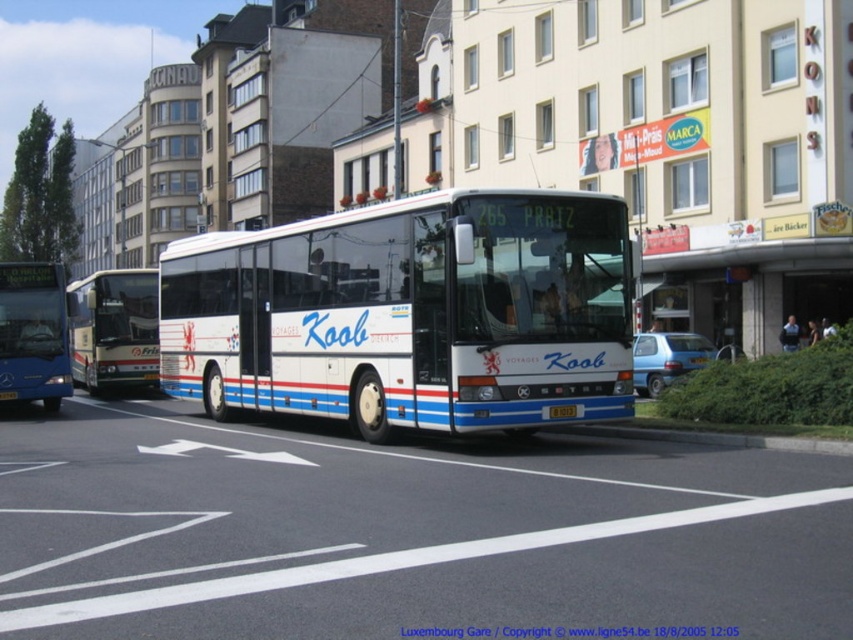
Question: Which point appears farthest from the camera in this image?

Choices:
 (A) coord(572,404)
 (B) coord(152,307)
 (C) coord(67,360)
 (D) coord(618,291)

Answer: (B)

Question: Does white glossy bus at center appear on the left side of matte silver bus at left?

Choices:
 (A) yes
 (B) no

Answer: (B)

Question: Which object is farther from the camera taking this photo?

Choices:
 (A) white glossy bus at center
 (B) matte silver bus at left
 (C) blue metallic bus at left

Answer: (B)

Question: Which of the following is the closest to the observer?

Choices:
 (A) (450, 396)
 (B) (550, 413)
 (C) (26, 365)

Answer: (A)

Question: Is matte silver bus at left wider than yellow metallic license plate at center?

Choices:
 (A) yes
 (B) no

Answer: (A)

Question: Is white glossy bus at center positioned behind yellow metallic license plate at center?

Choices:
 (A) yes
 (B) no

Answer: (B)